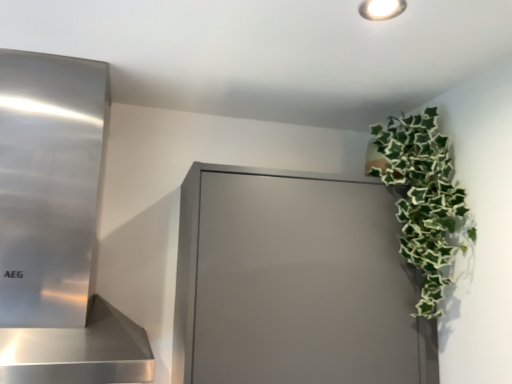
Question: Relative to polished stainless steel range hood at left, is matte gray cabinet at upper right in front or behind?

Choices:
 (A) behind
 (B) front

Answer: (A)

Question: From a real-world perspective, is matte gray cabinet at upper right above or below polished stainless steel range hood at left?

Choices:
 (A) below
 (B) above

Answer: (A)

Question: Based on their relative distances, which object is farther from the matte gray cabinet at upper right?

Choices:
 (A) polished stainless steel range hood at left
 (B) green leafy plant at upper right

Answer: (A)

Question: Estimate the real-world distances between objects in this image. Which object is closer to the polished stainless steel range hood at left?

Choices:
 (A) green leafy plant at upper right
 (B) matte gray cabinet at upper right

Answer: (B)